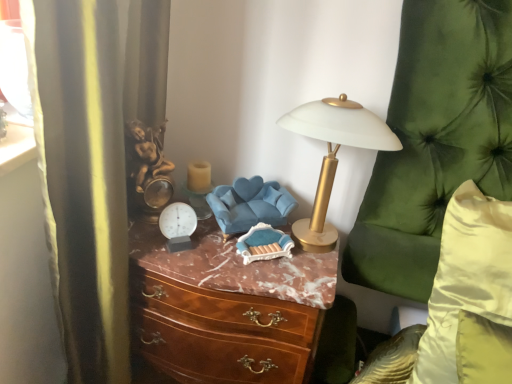
Question: Does blue fabric swivel chair at center turn towards marble/wooden chest of drawers at center?

Choices:
 (A) no
 (B) yes

Answer: (A)

Question: Does blue fabric swivel chair at center have a lesser width compared to marble/wooden chest of drawers at center?

Choices:
 (A) yes
 (B) no

Answer: (A)

Question: Does blue fabric swivel chair at center have a greater height compared to marble/wooden chest of drawers at center?

Choices:
 (A) yes
 (B) no

Answer: (B)

Question: From a real-world perspective, is blue fabric swivel chair at center positioned under marble/wooden chest of drawers at center based on gravity?

Choices:
 (A) no
 (B) yes

Answer: (A)

Question: From the image's perspective, is blue fabric swivel chair at center below marble/wooden chest of drawers at center?

Choices:
 (A) no
 (B) yes

Answer: (A)

Question: Is blue fabric swivel chair at center smaller than marble/wooden chest of drawers at center?

Choices:
 (A) yes
 (B) no

Answer: (A)

Question: Can you confirm if silky yellow pillow at right is bigger than translucent glass candle at center?

Choices:
 (A) yes
 (B) no

Answer: (A)

Question: Is silky yellow pillow at right at the right side of translucent glass candle at center?

Choices:
 (A) yes
 (B) no

Answer: (A)

Question: From a real-world perspective, is silky yellow pillow at right physically above translucent glass candle at center?

Choices:
 (A) no
 (B) yes

Answer: (A)

Question: Could you tell me if silky yellow pillow at right is turned towards translucent glass candle at center?

Choices:
 (A) yes
 (B) no

Answer: (B)

Question: From a real-world perspective, does silky yellow pillow at right sit lower than translucent glass candle at center?

Choices:
 (A) yes
 (B) no

Answer: (A)

Question: Considering the relative sizes of silky yellow pillow at right and translucent glass candle at center in the image provided, is silky yellow pillow at right shorter than translucent glass candle at center?

Choices:
 (A) yes
 (B) no

Answer: (B)

Question: Considering the relative sizes of blue fabric swivel chair at center and silky yellow pillow at right in the image provided, is blue fabric swivel chair at center taller than silky yellow pillow at right?

Choices:
 (A) no
 (B) yes

Answer: (A)